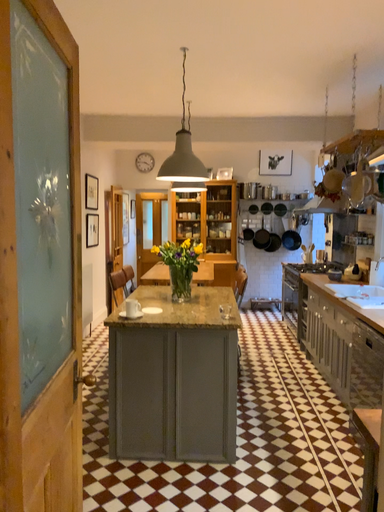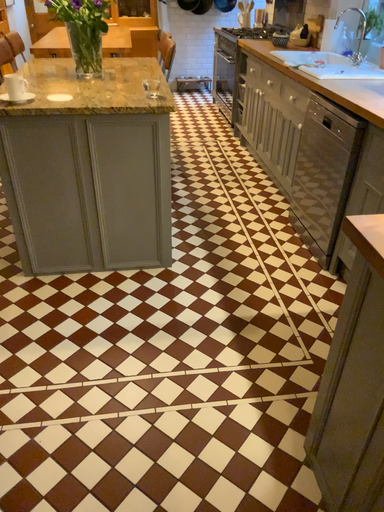
Question: How did the camera likely rotate when shooting the video?

Choices:
 (A) rotated downward
 (B) rotated upward

Answer: (A)